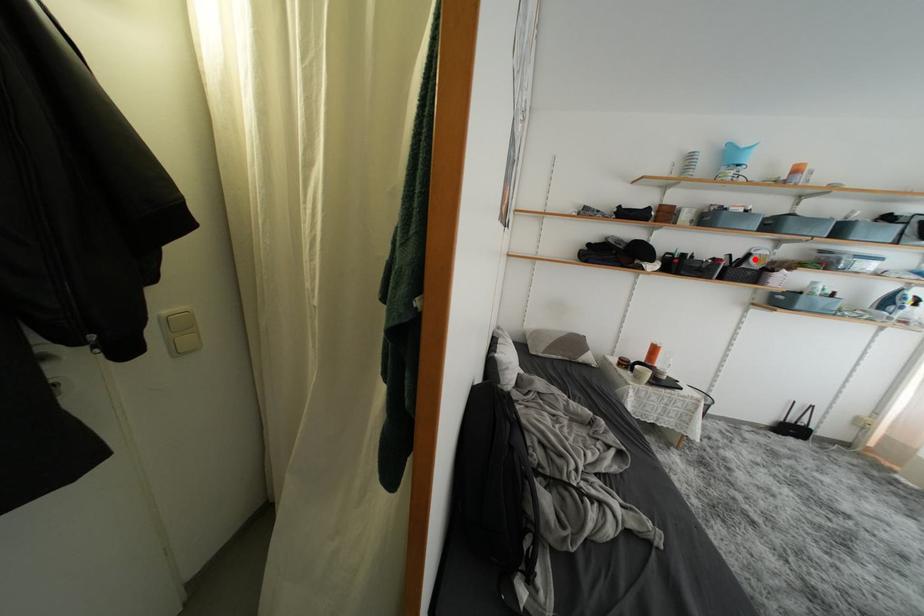
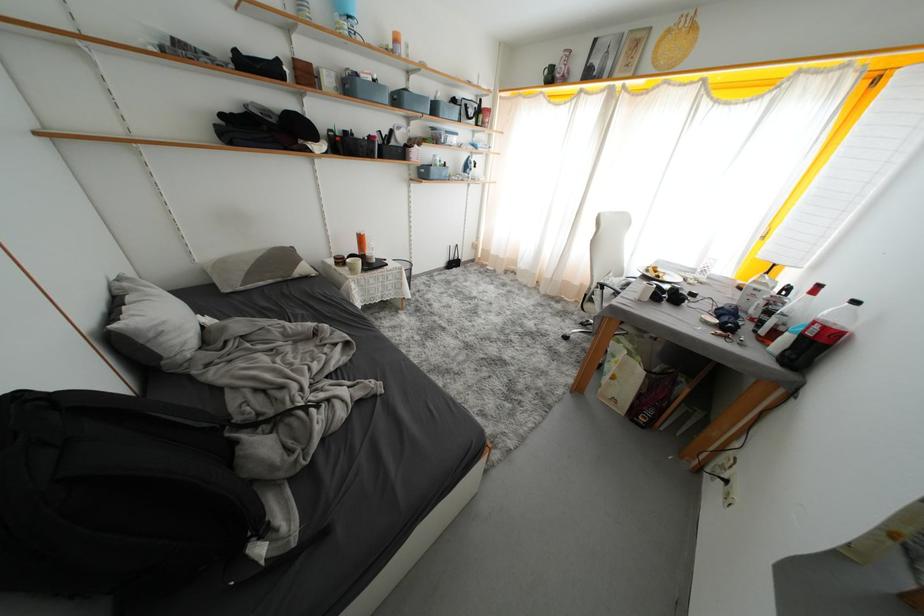
Question: I am providing you with two images of the same scene from different viewpoints. A red point is shown in image1. For the corresponding object point in image2, is it positioned nearer or farther from the camera?

Choices:
 (A) Nearer
 (B) Farther

Answer: (A)